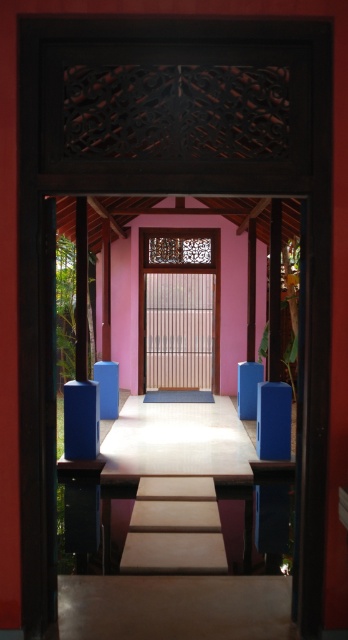
Who is higher up, wooden screen door at center or blue matte pillar at right?

Positioned higher is wooden screen door at center.

Where is `wooden screen door at center`? wooden screen door at center is located at coordinates (178, 308).